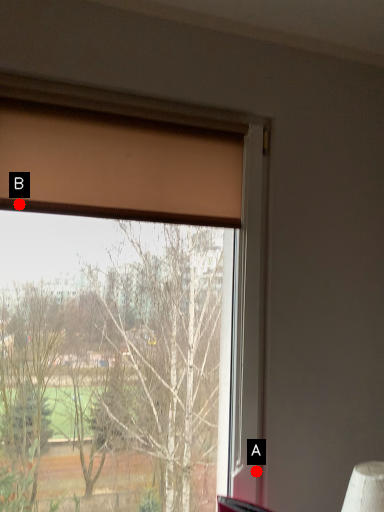
Question: Two points are circled on the image, labeled by A and B beside each circle. Which point is further to the camera?

Choices:
 (A) A is further
 (B) B is further

Answer: (A)